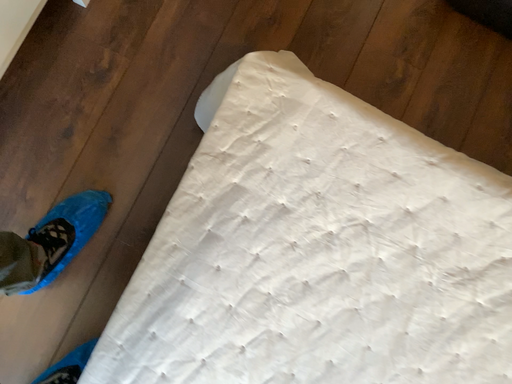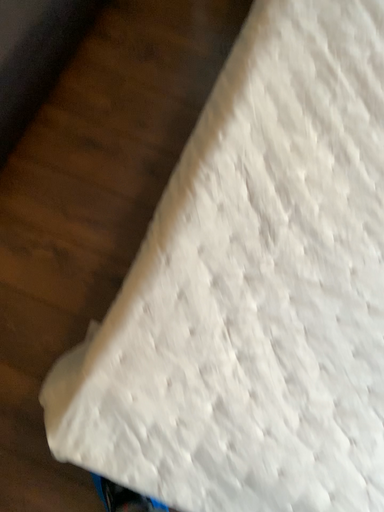
Question: How did the camera likely rotate when shooting the video?

Choices:
 (A) rotated right
 (B) rotated left

Answer: (A)